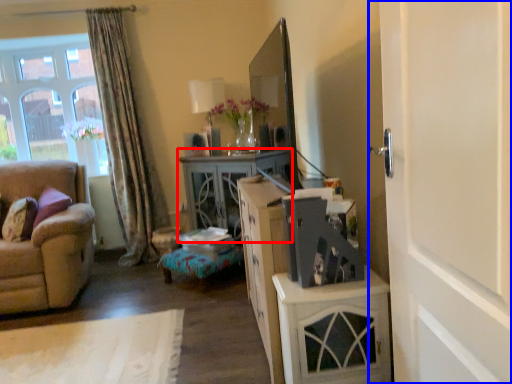
Question: Among these objects, which one is nearest to the camera, desk (highlighted by a red box) or door (highlighted by a blue box)?

Choices:
 (A) desk
 (B) door

Answer: (B)